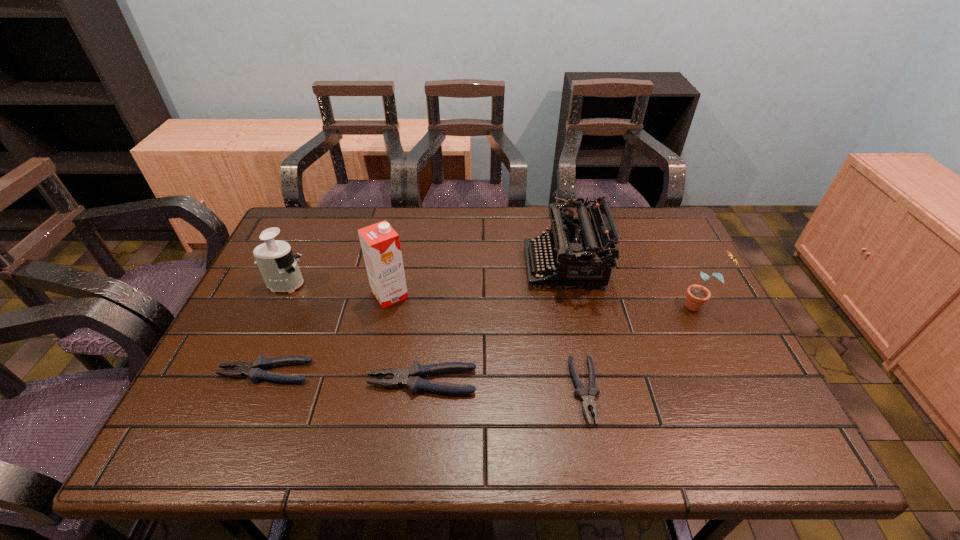
Locate an element on the screen. free spot located at the gripping part of the second pliers from right to left is located at coordinates (250, 381).

At what (x,y) coordinates should I click in order to perform the action: click on vacant space located 0.100m at the gripping part of the second pliers from right to left. Please return your answer as a coordinate pair (x, y). The image size is (960, 540). Looking at the image, I should click on (324, 381).

Locate an element on the screen. free region located 0.170m on the keyboard of the typewriter is located at coordinates (468, 266).

I want to click on blank area located on the keyboard of the typewriter, so click(478, 266).

You are a GUI agent. You are given a task and a screenshot of the screen. Output one action in this format:
    pyautogui.click(x=<x>, y=<y>)
    Task: Click on the vacant area situated 0.260m on the keyboard of the typewriter
    This screenshot has height=540, width=960.
    Given the screenshot: What is the action you would take?
    pyautogui.click(x=437, y=266)

Where is `vacant space situated 0.120m on the left of the carton`? The height and width of the screenshot is (540, 960). vacant space situated 0.120m on the left of the carton is located at coordinates click(x=327, y=295).

The image size is (960, 540). I want to click on vacant space situated on the flower of the rightmost object, so click(x=536, y=305).

This screenshot has width=960, height=540. Find the location of `vacant point located on the flower of the rightmost object`. vacant point located on the flower of the rightmost object is located at coordinates point(536,305).

At what (x,y) coordinates should I click in order to perform the action: click on vacant region located on the flower of the rightmost object. Please return your answer as a coordinate pair (x, y). Looking at the image, I should click on (585, 305).

Identify the location of free space located 0.300m on the back of the juicer. (318, 214).